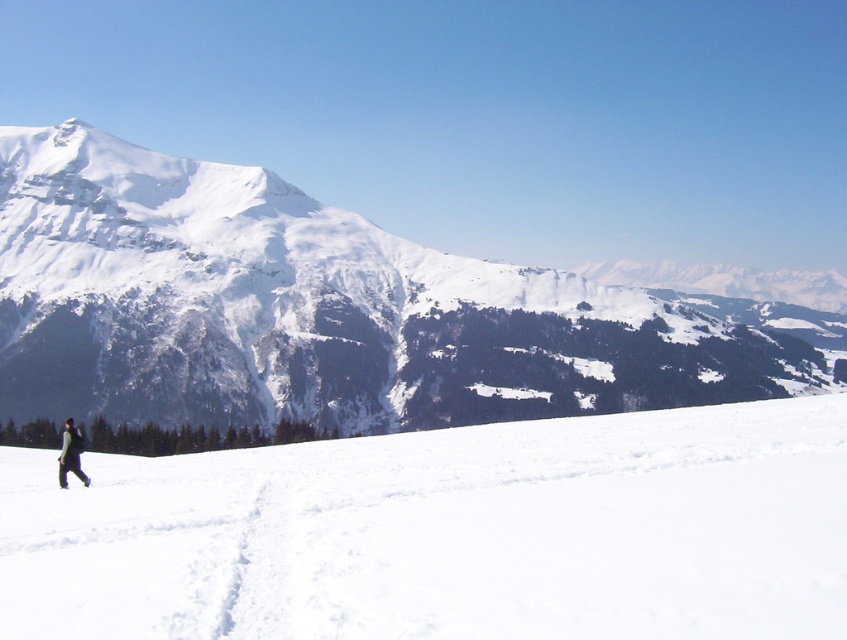
Is point (779, 624) positioned after point (73, 472)?

No, (779, 624) is closer to viewer.

Can you confirm if white snow at lower left is positioned to the left of dark green jacket at lower left?

In fact, white snow at lower left is to the right of dark green jacket at lower left.

Measure the distance between white snow at lower left and camera.

100.87 feet

This screenshot has height=640, width=847. In order to click on white snow at lower left in this screenshot , I will do `click(447, 532)`.

Can you confirm if white snow-covered mountain at left is positioned to the left of dark green jacket at lower left?

In fact, white snow-covered mountain at left is to the right of dark green jacket at lower left.

Who is more forward, (329, 321) or (61, 460)?

Point (61, 460) is in front.

Which is behind, point (363, 232) or point (82, 483)?

Positioned behind is point (363, 232).

Find the location of `white snow-covered mountain at left`. white snow-covered mountain at left is located at coordinates (314, 308).

Is white snow at lower left wider than black matte ski at lower left?

Correct, the width of white snow at lower left exceeds that of black matte ski at lower left.

Is point (665, 420) more distant than point (65, 484)?

That is True.

Locate an element on the screen. This screenshot has height=640, width=847. white snow at lower left is located at coordinates (447, 532).